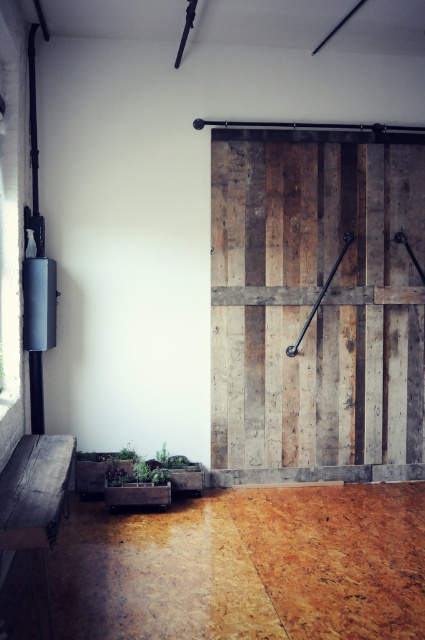
Question: Can you confirm if weathered wood barn door at center is positioned to the right of wooden bench at lower left?

Choices:
 (A) yes
 (B) no

Answer: (A)

Question: Is weathered wood barn door at center above wooden bench at lower left?

Choices:
 (A) no
 (B) yes

Answer: (B)

Question: Which point is closer to the camera?

Choices:
 (A) 16,536
 (B) 224,289

Answer: (A)

Question: Is weathered wood barn door at center smaller than wooden bench at lower left?

Choices:
 (A) no
 (B) yes

Answer: (A)

Question: Among these objects, which one is farthest from the camera?

Choices:
 (A) wooden bench at lower left
 (B) weathered wood barn door at center

Answer: (B)